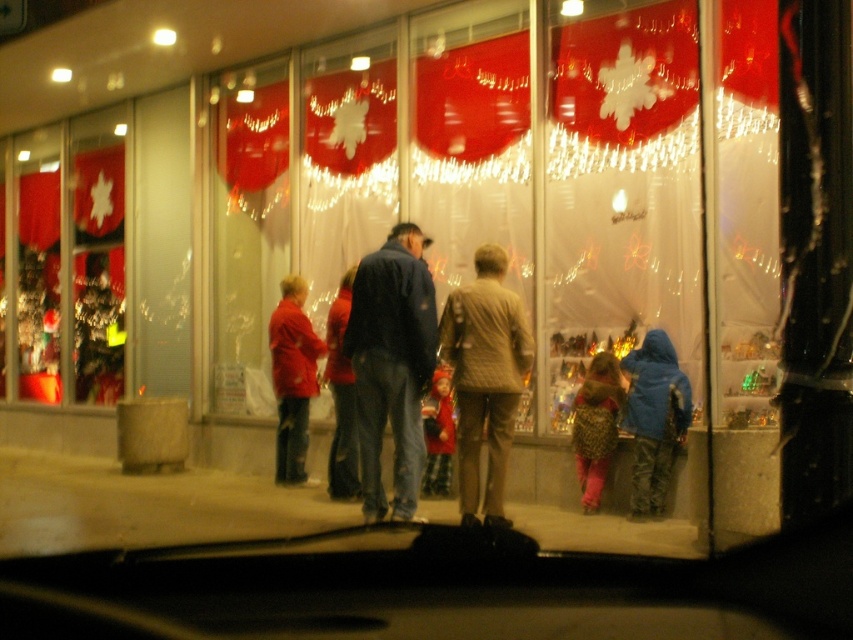
Is point (498, 381) positioned after point (437, 483)?

No, (498, 381) is closer to viewer.

Who is shorter, tan quilted jacket at center or velvet red coat at center?

velvet red coat at center

Identify the location of tan quilted jacket at center. (485, 376).

Consider the image. Does leopard print coat at center have a greater height compared to velvet red coat at center?

Yes, leopard print coat at center is taller than velvet red coat at center.

Is point (585, 452) farther from camera compared to point (438, 408)?

No.

Locate an element on the screen. The height and width of the screenshot is (640, 853). leopard print coat at center is located at coordinates (596, 426).

Does matte blue jacket at center appear under leopard print coat at center?

Actually, matte blue jacket at center is above leopard print coat at center.

Does matte blue jacket at center have a smaller size compared to leopard print coat at center?

Actually, matte blue jacket at center might be larger than leopard print coat at center.

Describe the element at coordinates (392, 364) in the screenshot. The image size is (853, 640). I see `matte blue jacket at center` at that location.

You are a GUI agent. You are given a task and a screenshot of the screen. Output one action in this format:
    pyautogui.click(x=<x>, y=<y>)
    Task: Click on the matte blue jacket at center
    The height and width of the screenshot is (640, 853).
    Given the screenshot: What is the action you would take?
    pyautogui.click(x=392, y=364)